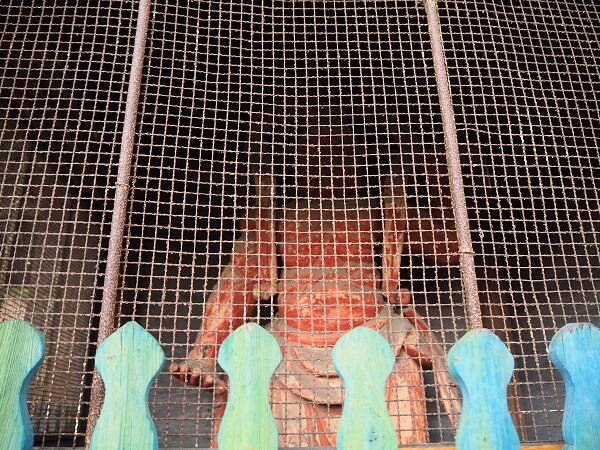
In order to click on wall in this screenshot , I will do `click(142, 307)`.